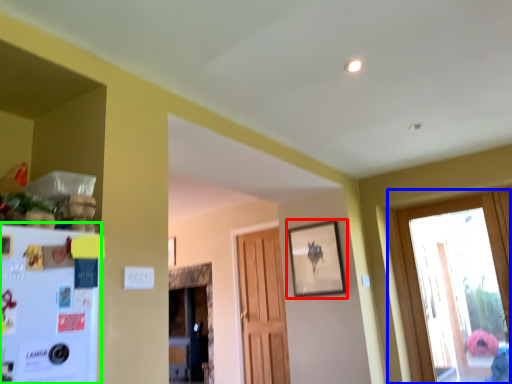
Question: Estimate the real-world distances between objects in this image. Which object is closer to picture frame (highlighted by a red box), window (highlighted by a blue box) or fridge (highlighted by a green box)?

Choices:
 (A) window
 (B) fridge

Answer: (B)